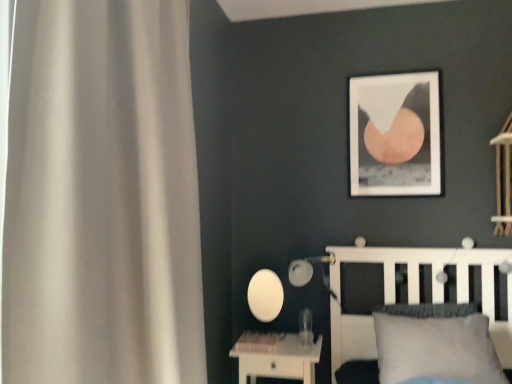
Question: Considering the relative sizes of white glossy nightstand at lower center and matte white table lamp at center in the image provided, is white glossy nightstand at lower center smaller than matte white table lamp at center?

Choices:
 (A) no
 (B) yes

Answer: (A)

Question: From a real-world perspective, is white glossy nightstand at lower center on top of matte white table lamp at center?

Choices:
 (A) no
 (B) yes

Answer: (A)

Question: Is white glossy nightstand at lower center not inside matte white table lamp at center?

Choices:
 (A) yes
 (B) no

Answer: (A)

Question: Are white glossy nightstand at lower center and matte white table lamp at center far apart?

Choices:
 (A) yes
 (B) no

Answer: (B)

Question: Does white glossy nightstand at lower center come in front of matte white table lamp at center?

Choices:
 (A) yes
 (B) no

Answer: (A)

Question: From the image's perspective, is white glossy nightstand at lower center under matte white table lamp at center?

Choices:
 (A) yes
 (B) no

Answer: (A)

Question: Does white glossy nightstand at lower center have a greater height compared to white matte bed at lower right?

Choices:
 (A) no
 (B) yes

Answer: (A)

Question: Is white glossy nightstand at lower center positioned before white matte bed at lower right?

Choices:
 (A) no
 (B) yes

Answer: (A)

Question: From a real-world perspective, is white glossy nightstand at lower center under white matte bed at lower right?

Choices:
 (A) yes
 (B) no

Answer: (A)

Question: Is white glossy nightstand at lower center smaller than white matte bed at lower right?

Choices:
 (A) no
 (B) yes

Answer: (B)

Question: Does white glossy nightstand at lower center have a lesser height compared to white matte bed at lower right?

Choices:
 (A) no
 (B) yes

Answer: (B)

Question: From the image's perspective, would you say white glossy nightstand at lower center is positioned over white matte bed at lower right?

Choices:
 (A) yes
 (B) no

Answer: (B)

Question: Is white matte curtain at left a part of white matte bed at lower right?

Choices:
 (A) yes
 (B) no

Answer: (B)